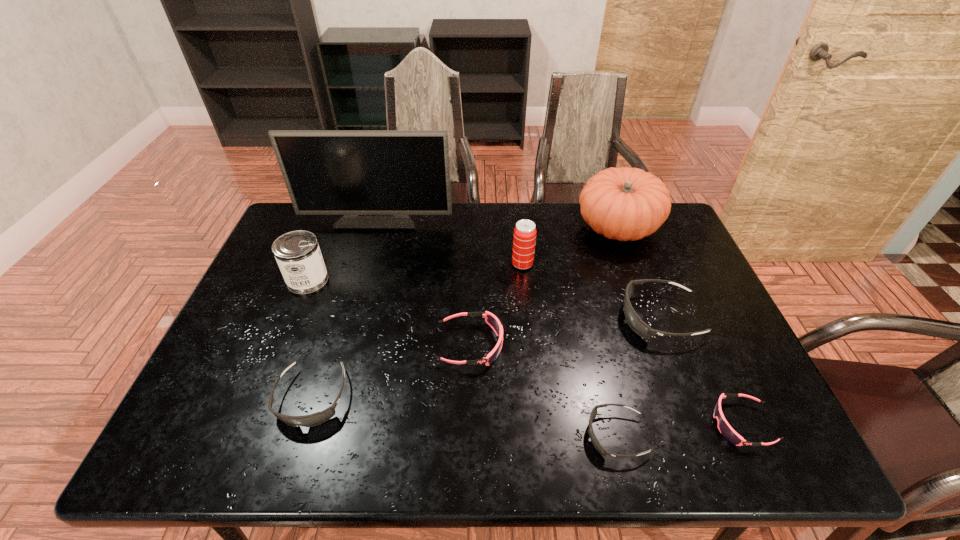
Find the location of `vacant space situated 0.330m on the lenses of the rightmost black goggles`. vacant space situated 0.330m on the lenses of the rightmost black goggles is located at coordinates (499, 318).

Locate an element on the screen. vacant area situated 0.270m on the lenses of the rightmost black goggles is located at coordinates (521, 318).

Image resolution: width=960 pixels, height=540 pixels. In order to click on vacant point located 0.100m on the lenses of the rightmost black goggles in this screenshot , I will do `click(584, 318)`.

Find the location of a particular element. This screenshot has height=540, width=960. vacant space located 0.140m on the front-facing side of the bigger pink goggles is located at coordinates (558, 345).

Image resolution: width=960 pixels, height=540 pixels. Identify the location of vacant space located 0.190m on the front-facing side of the right pink goggles. (628, 424).

The image size is (960, 540). What are the coordinates of `vacant area situated 0.200m on the front-facing side of the right pink goggles` in the screenshot? It's located at (623, 424).

The height and width of the screenshot is (540, 960). I want to click on vacant space located on the front-facing side of the right pink goggles, so click(641, 424).

The height and width of the screenshot is (540, 960). I want to click on vacant point located 0.300m on the lenses of the smallest black goggles, so click(448, 435).

Identify the location of free space located 0.130m on the lenses of the smallest black goggles. (527, 435).

The width and height of the screenshot is (960, 540). In order to click on vacant area situated 0.050m on the lenses of the smallest black goggles in this screenshot , I will do [x=564, y=435].